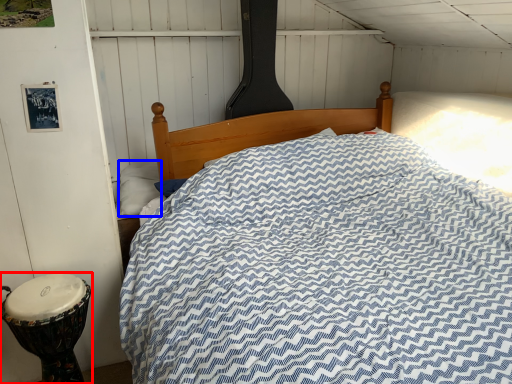
Question: Which object is closer to the camera taking this photo, drum (highlighted by a red box) or pillow (highlighted by a blue box)?

Choices:
 (A) drum
 (B) pillow

Answer: (A)